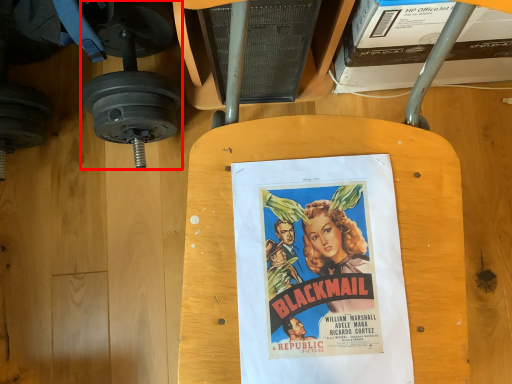
Question: From the image's perspective, where is dumbbell (annotated by the red box) located in relation to poster in the image?

Choices:
 (A) below
 (B) above

Answer: (B)